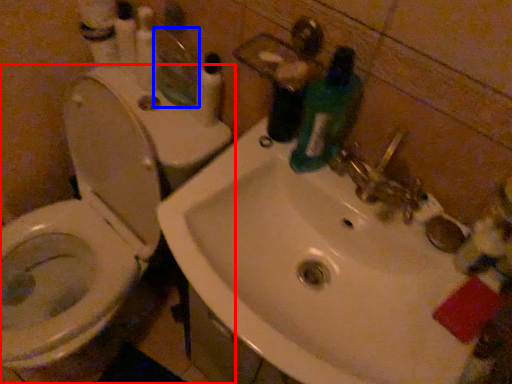
Question: Which of the following is the closest to the observer, toilet (highlighted by a red box) or mirror (highlighted by a blue box)?

Choices:
 (A) toilet
 (B) mirror

Answer: (A)